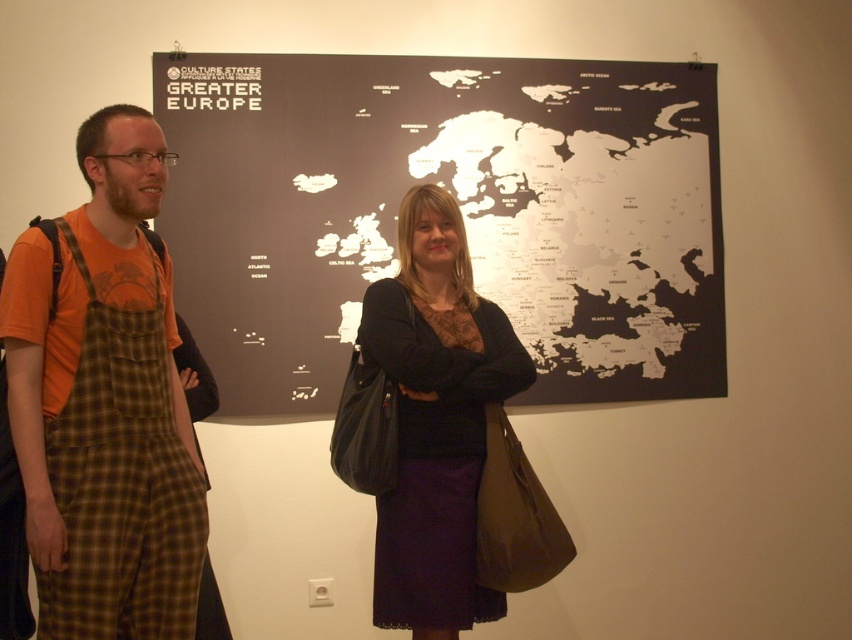
Question: Considering the real-world distances, which object is farthest from the black matte map at center?

Choices:
 (A) orange t-shirt at left
 (B) matte black dress at center

Answer: (A)

Question: Based on their relative distances, which object is nearer to the orange t-shirt at left?

Choices:
 (A) matte black dress at center
 (B) black matte map at center

Answer: (A)

Question: Observing the image, what is the correct spatial positioning of black matte map at center in reference to matte black dress at center?

Choices:
 (A) above
 (B) below

Answer: (A)

Question: Observing the image, what is the correct spatial positioning of black matte map at center in reference to orange t-shirt at left?

Choices:
 (A) left
 (B) right

Answer: (B)

Question: Does black matte map at center have a greater width compared to orange t-shirt at left?

Choices:
 (A) yes
 (B) no

Answer: (A)

Question: Based on their relative distances, which object is nearer to the matte black dress at center?

Choices:
 (A) orange t-shirt at left
 (B) black matte map at center

Answer: (A)